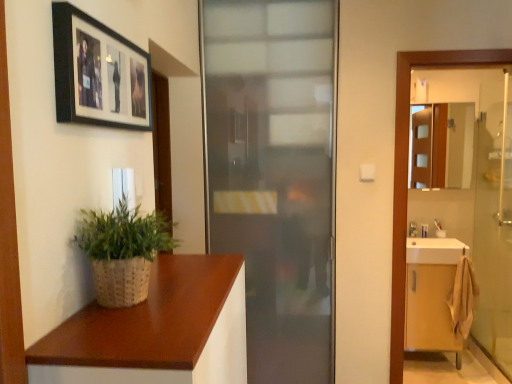
Question: Is point (122, 228) closer or farther from the camera than point (506, 130)?

Choices:
 (A) closer
 (B) farther

Answer: (A)

Question: From the image's perspective, is woven natural plant at lower left positioned above or below clear glass screen door at right?

Choices:
 (A) below
 (B) above

Answer: (B)

Question: Estimate the real-world distances between objects in this image. Which object is farther from the woven natural plant at lower left?

Choices:
 (A) clear glass screen door at right
 (B) white glossy sink at right
 (C) frosted glass door at center
 (D) light wood cabinet at right
 (E) wooden cabinet at right

Answer: (E)

Question: Which object is the farthest from the wooden cabinet at right?

Choices:
 (A) light wood cabinet at right
 (B) transparent glass elevator at right
 (C) black matte picture frame at upper left
 (D) frosted glass door at center
 (E) white glossy sink at right

Answer: (C)